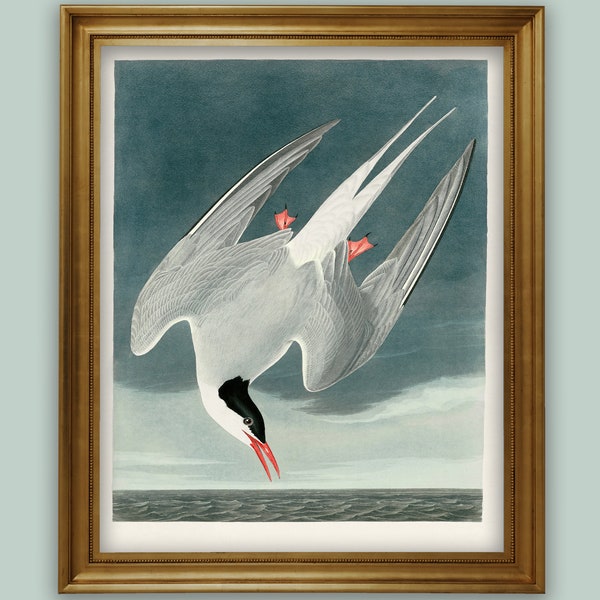
At what (x,y) coordinates should I click in order to perform the action: click on mat. Please return your answer as a coordinate pair (x, y). This screenshot has width=600, height=600. Looking at the image, I should click on (411, 537).